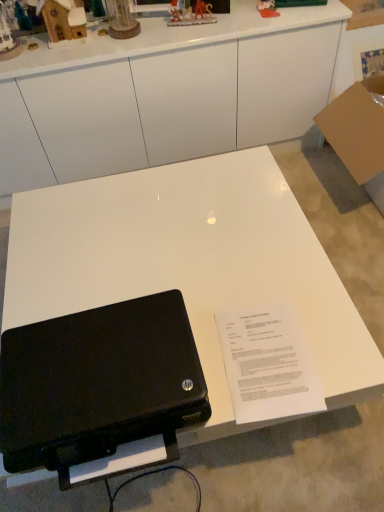
Identify the location of vacant space that is in between metallic silver sleigh at upper center, the 4th toy in the left-to-right sequence, and plastic toy at upper center, which ranks as the 1th toy in right-to-left order. (224, 16).